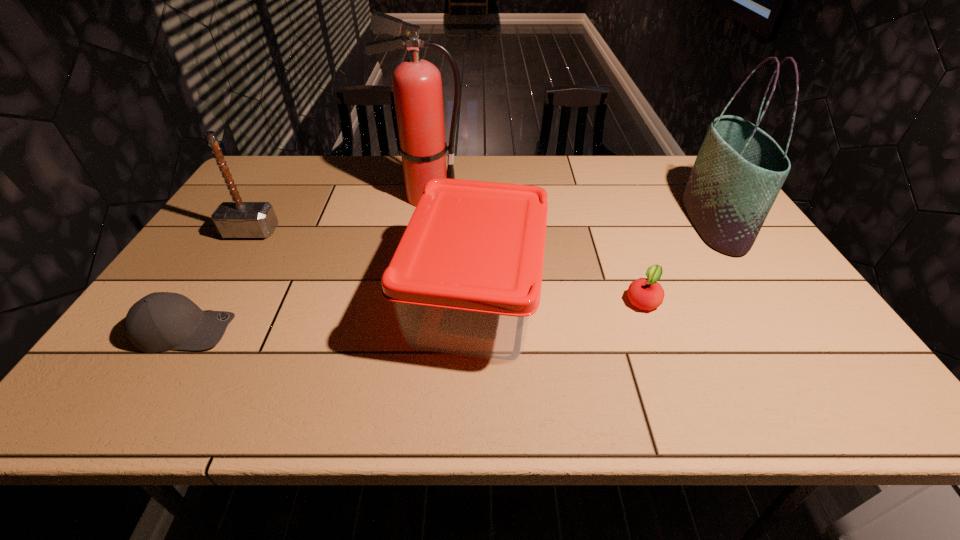
This screenshot has height=540, width=960. I want to click on fire extinguisher, so click(x=417, y=86).

This screenshot has height=540, width=960. I want to click on tote bag, so click(739, 171).

Locate an element on the screen. Image resolution: width=960 pixels, height=540 pixels. hammer is located at coordinates (237, 219).

This screenshot has height=540, width=960. I want to click on the fourth tallest object, so click(x=466, y=277).

This screenshot has height=540, width=960. Identify the location of baseball cap. (160, 321).

In order to click on the shortest object in this screenshot , I will do `click(644, 293)`.

Find the location of a particular element. The width and height of the screenshot is (960, 540). apple is located at coordinates (644, 293).

Where is `free space located on the hose direction of the fire extinguisher`? This screenshot has height=540, width=960. free space located on the hose direction of the fire extinguisher is located at coordinates (495, 197).

Where is `free region located on the back of the tote bag`? The height and width of the screenshot is (540, 960). free region located on the back of the tote bag is located at coordinates click(x=679, y=169).

What are the coordinates of `vacant space located on the striking surface of the hammer` in the screenshot? It's located at (204, 306).